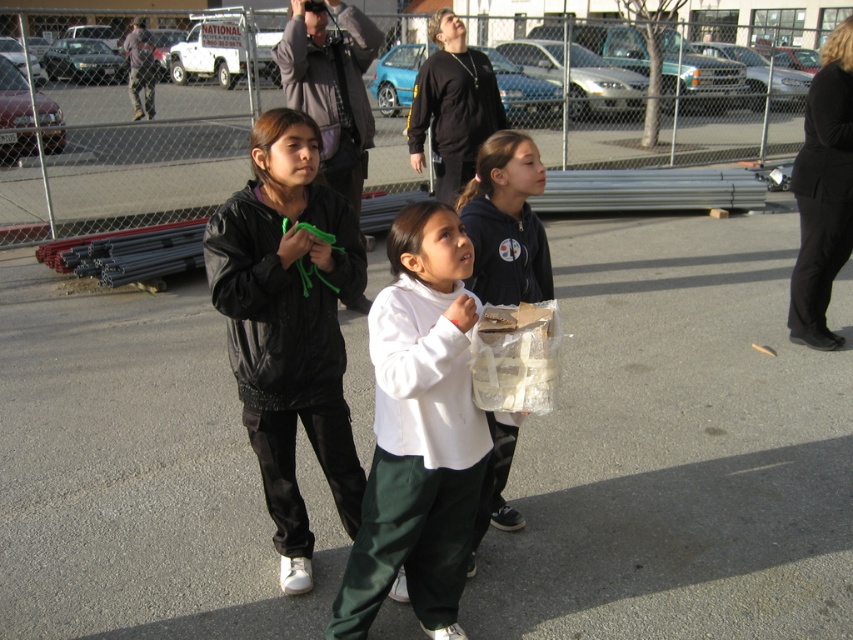
Question: Which point is farther to the camera?

Choices:
 (A) (28, 38)
 (B) (451, 88)

Answer: (A)

Question: Does metallic chain-link fence at upper center appear on the left side of black fabric pants at right?

Choices:
 (A) no
 (B) yes

Answer: (B)

Question: Is black matte jacket at center bigger than white matte shirt at center?

Choices:
 (A) yes
 (B) no

Answer: (A)

Question: Which point appears farthest from the camera in this image?

Choices:
 (A) (258, 266)
 (B) (483, 19)
 (C) (849, 141)
 (D) (390, 348)

Answer: (B)

Question: Can you confirm if metallic chain-link fence at upper center is positioned to the right of black matte jacket at center?

Choices:
 (A) no
 (B) yes

Answer: (B)

Question: Which object is positioned closest to the black matte jacket at center?

Choices:
 (A) white matte shirt at center
 (B) black matte sweatshirt at upper center

Answer: (A)